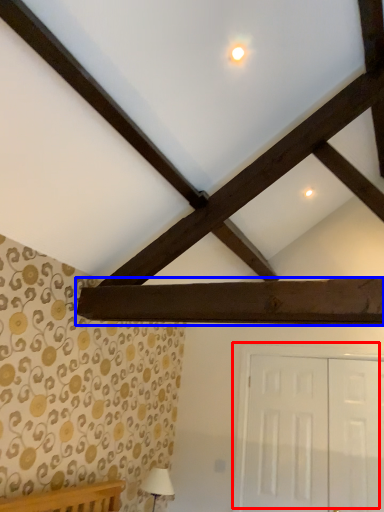
Question: Which point is further to the camera, door (highlighted by a red box) or plank (highlighted by a blue box)?

Choices:
 (A) door
 (B) plank

Answer: (A)